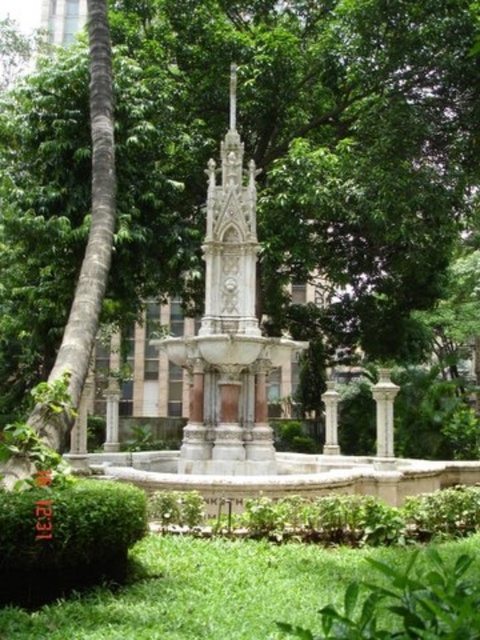
Who is more forward, (392, 440) or (336, 444)?

Positioned in front is point (392, 440).

Can you confirm if white marble column at lower right is thinner than white stone column at center?

Incorrect, white marble column at lower right's width is not less than white stone column at center's.

The image size is (480, 640). Describe the element at coordinates (384, 412) in the screenshot. I see `white marble column at lower right` at that location.

Where is `white marble column at lower right`? This screenshot has height=640, width=480. white marble column at lower right is located at coordinates (384, 412).